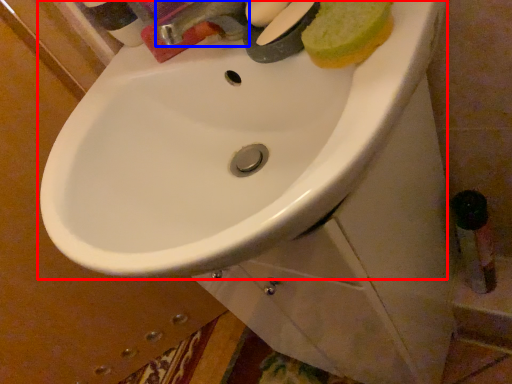
Question: Which object appears farthest to the camera in this image, sink (highlighted by a red box) or tap (highlighted by a blue box)?

Choices:
 (A) sink
 (B) tap

Answer: (B)